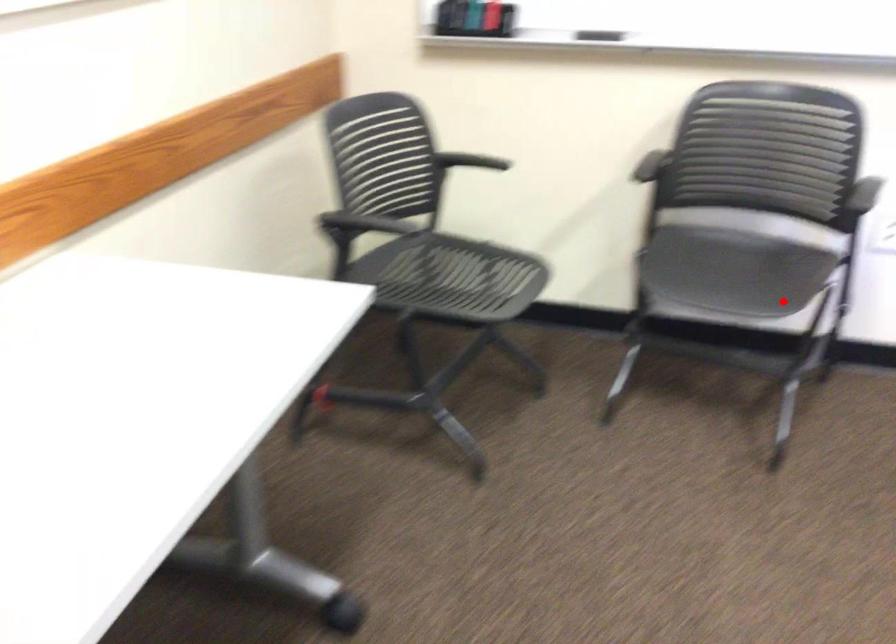
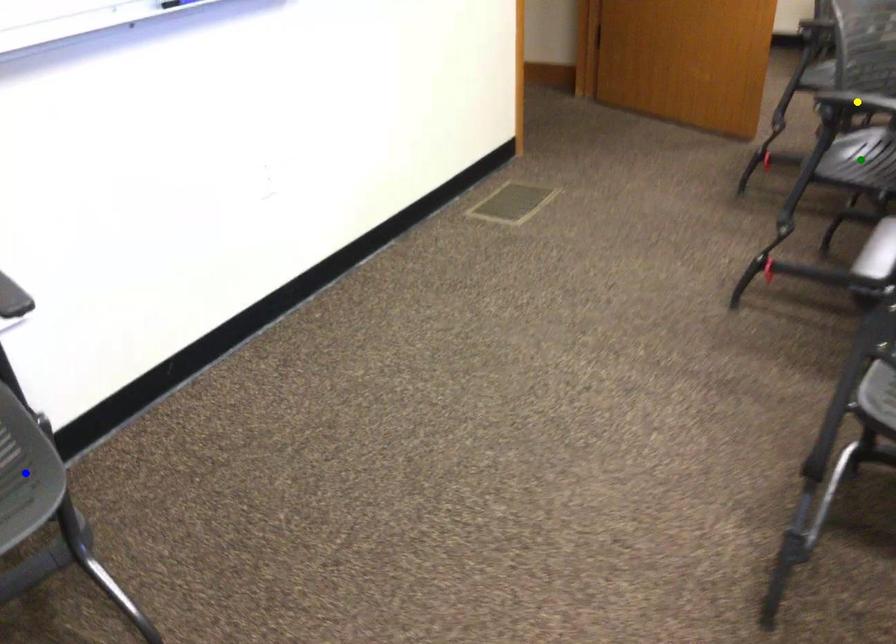
Question: I am providing you with two images of the same scene from different viewpoints. A red point is marked on the first image. You are given multiple points on the second image. Which mark in image 2 goes with the point in image 1?

Choices:
 (A) green point
 (B) yellow point
 (C) blue point

Answer: (C)